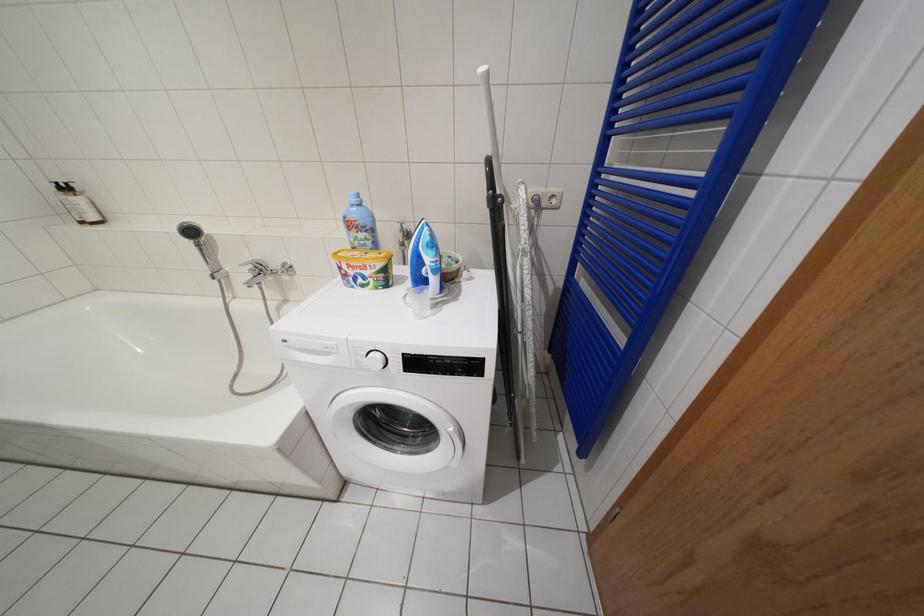
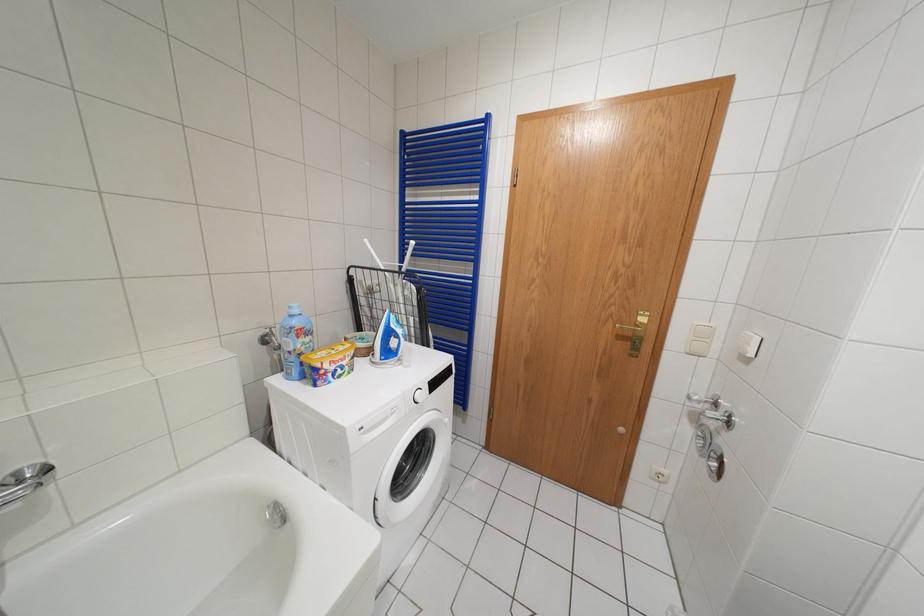
Question: Based on the continuous images, in which direction is the camera rotating? Reply with the corresponding letter.

Choices:
 (A) Left
 (B) Right
 (C) Up
 (D) Down

Answer: (B)